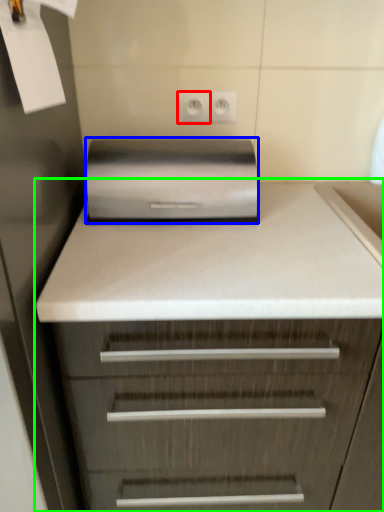
Question: Estimate the real-world distances between objects in this image. Which object is farther from electric outlet (highlighted by a red box), home appliance (highlighted by a blue box) or chest of drawers (highlighted by a green box)?

Choices:
 (A) home appliance
 (B) chest of drawers

Answer: (B)